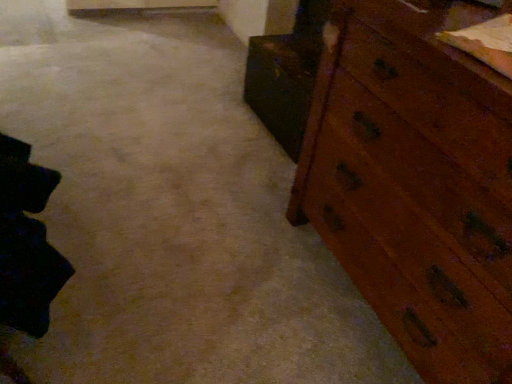
Question: Should I look upward or downward to see wooden cabinet at right?

Choices:
 (A) down
 (B) up

Answer: (B)

Question: Does wooden chest of drawers at right have a lesser width compared to wooden cabinet at right?

Choices:
 (A) yes
 (B) no

Answer: (B)

Question: Is wooden cabinet at right a part of wooden chest of drawers at right?

Choices:
 (A) no
 (B) yes

Answer: (A)

Question: Does wooden chest of drawers at right appear on the right side of wooden cabinet at right?

Choices:
 (A) yes
 (B) no

Answer: (A)

Question: From a real-world perspective, is wooden chest of drawers at right positioned under wooden cabinet at right based on gravity?

Choices:
 (A) yes
 (B) no

Answer: (B)

Question: From the image's perspective, is wooden chest of drawers at right under wooden cabinet at right?

Choices:
 (A) no
 (B) yes

Answer: (B)

Question: From the image's perspective, is wooden chest of drawers at right located above wooden cabinet at right?

Choices:
 (A) no
 (B) yes

Answer: (A)

Question: Is wooden cabinet at right smaller than wooden chest of drawers at right?

Choices:
 (A) yes
 (B) no

Answer: (A)

Question: Could you tell me if wooden cabinet at right is facing wooden chest of drawers at right?

Choices:
 (A) no
 (B) yes

Answer: (A)

Question: Is wooden cabinet at right facing away from wooden chest of drawers at right?

Choices:
 (A) yes
 (B) no

Answer: (B)

Question: Does wooden cabinet at right appear on the right side of wooden chest of drawers at right?

Choices:
 (A) no
 (B) yes

Answer: (A)

Question: Is the depth of wooden cabinet at right greater than that of wooden chest of drawers at right?

Choices:
 (A) yes
 (B) no

Answer: (A)

Question: Can you confirm if wooden cabinet at right is taller than wooden chest of drawers at right?

Choices:
 (A) no
 (B) yes

Answer: (A)

Question: Looking at the image, does wooden chest of drawers at right seem bigger or smaller compared to wooden cabinet at right?

Choices:
 (A) big
 (B) small

Answer: (A)